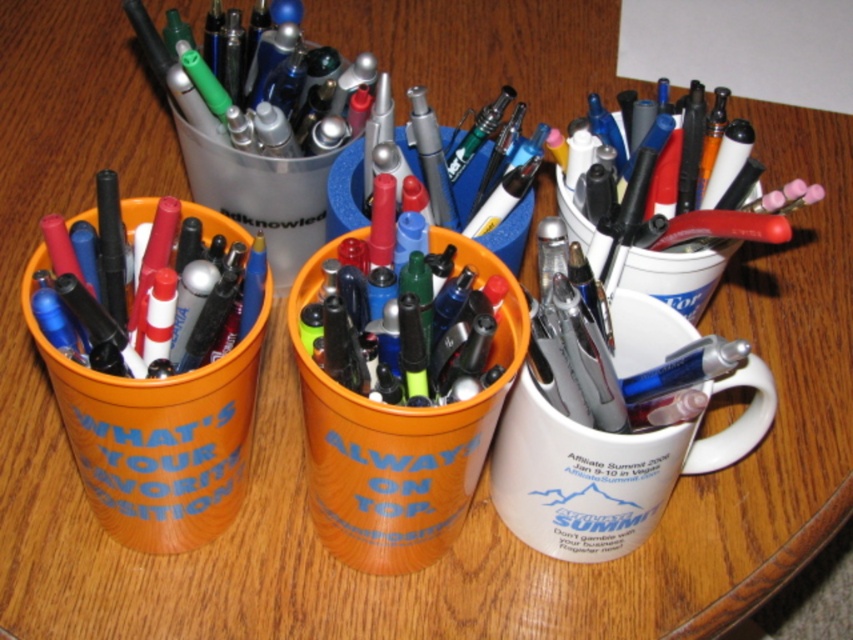
Question: Can you confirm if matte black pen at left is positioned above white glossy mug at upper right?

Choices:
 (A) yes
 (B) no

Answer: (B)

Question: Can you confirm if white ceramic mug at center is wider than metallic silver pen at center?

Choices:
 (A) yes
 (B) no

Answer: (A)

Question: Does white ceramic mug at center appear over matte black pen at left?

Choices:
 (A) no
 (B) yes

Answer: (A)

Question: Which of these objects is positioned closest to the matte black pen at left?

Choices:
 (A) metallic silver pen at center
 (B) white ceramic mug at center
 (C) white glossy mug at upper right

Answer: (A)

Question: Considering the real-world distances, which object is closest to the metallic silver pen at center?

Choices:
 (A) white glossy mug at upper right
 (B) matte black pen at left

Answer: (A)

Question: Which object appears farthest from the camera in this image?

Choices:
 (A) metallic silver pen at center
 (B) white ceramic mug at center

Answer: (A)